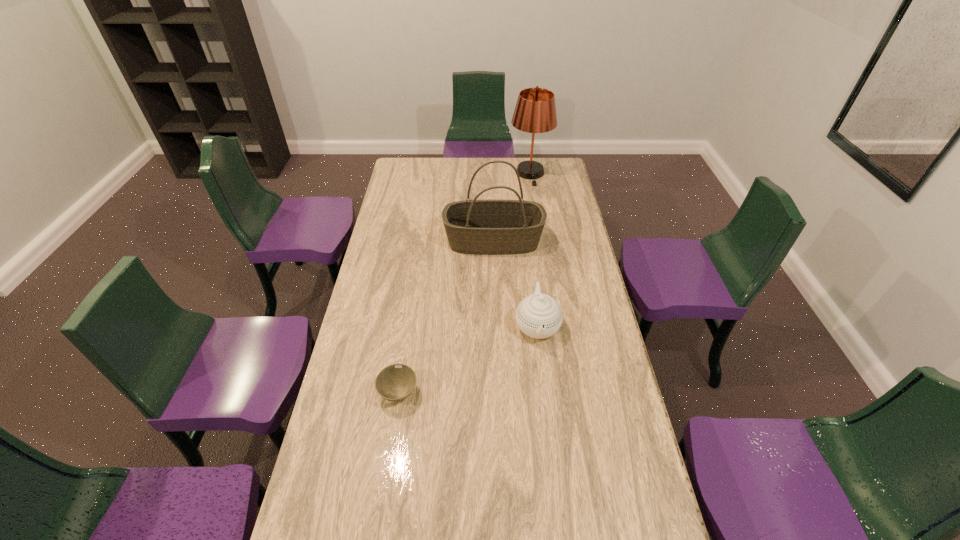
Find the location of a particular element. The width and height of the screenshot is (960, 540). the farthest object is located at coordinates (535, 112).

Where is `the tallest object`? the tallest object is located at coordinates (535, 112).

Locate an element on the screen. The width and height of the screenshot is (960, 540). basket is located at coordinates (488, 227).

Locate an element on the screen. This screenshot has height=540, width=960. the second farthest object is located at coordinates (488, 227).

Locate an element on the screen. The image size is (960, 540). chinaware is located at coordinates (539, 316).

You are a GUI agent. You are given a task and a screenshot of the screen. Output one action in this format:
    pyautogui.click(x=<x>, y=<y>)
    Task: Click on the third tallest object
    
    Given the screenshot: What is the action you would take?
    pyautogui.click(x=539, y=316)

Locate an element on the screen. the nearest object is located at coordinates (395, 382).

Identify the location of bowl. (395, 382).

Image resolution: width=960 pixels, height=540 pixels. What are the coordinates of `vacant space situated 0.250m on the front-facing side of the tallest object` in the screenshot? It's located at click(537, 215).

Find the location of a particular element. vacant space located on the front of the basket is located at coordinates (496, 328).